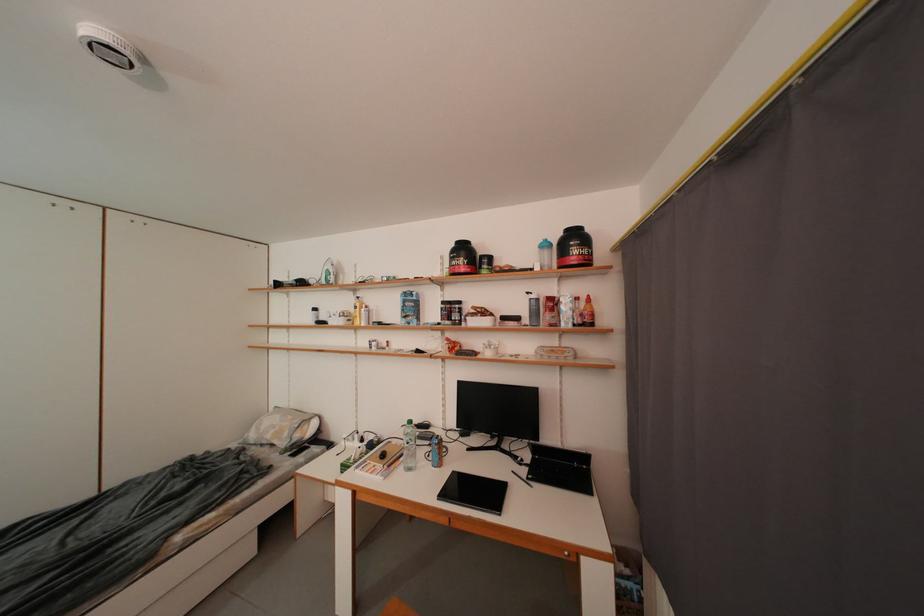
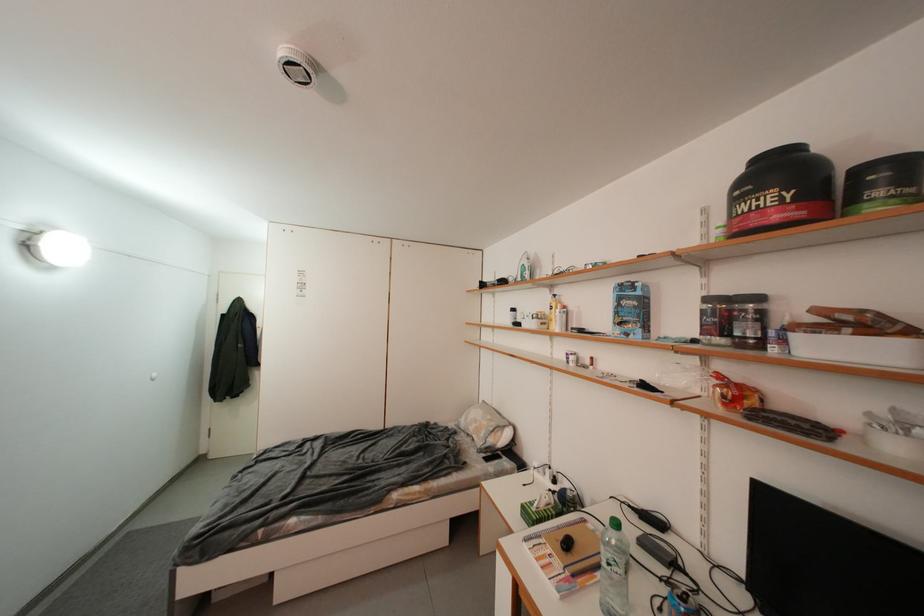
Question: How did the camera likely rotate?

Choices:
 (A) Left
 (B) Right
 (C) Up
 (D) Down

Answer: (A)